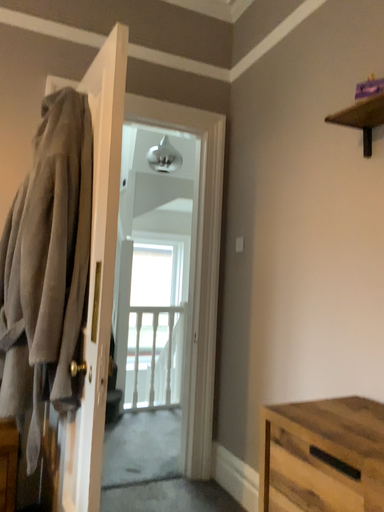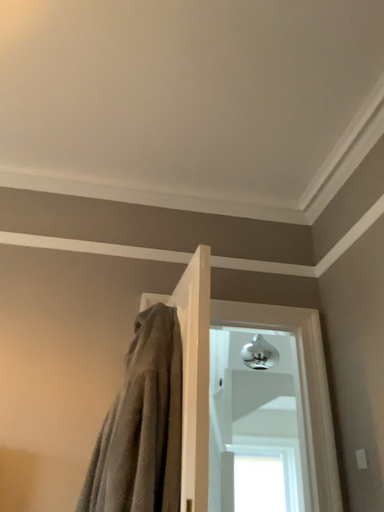
Question: Which way did the camera rotate in the video?

Choices:
 (A) rotated left
 (B) rotated right

Answer: (A)